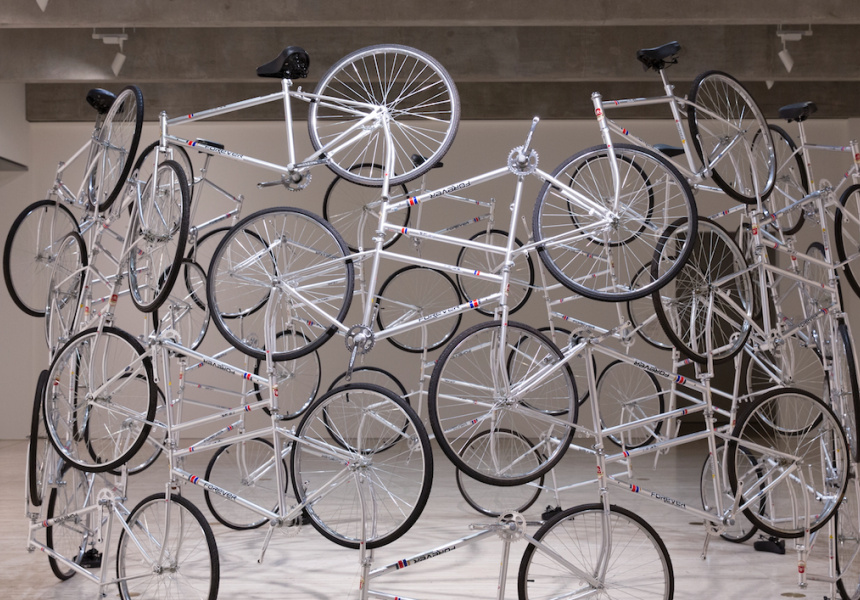
At what (x,y) coordinates should I click in order to perform the action: click on light. Please return your answer as a coordinate pair (x, y). The width and height of the screenshot is (860, 600). Looking at the image, I should click on (115, 37), (785, 35).